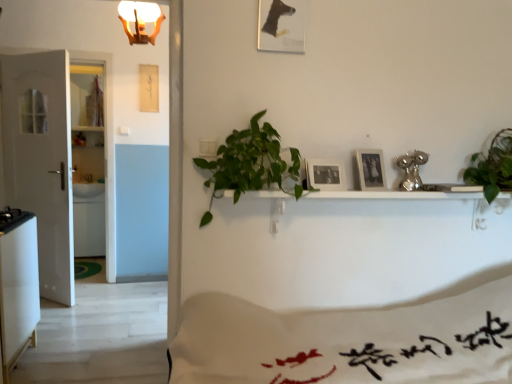
Question: Relative to matte wooden picture frame at upper center, acting as the third picture frame starting from the left, is white glossy refrigerator at lower left in front or behind?

Choices:
 (A) front
 (B) behind

Answer: (B)

Question: In terms of height, does white glossy refrigerator at lower left look taller or shorter compared to matte wooden picture frame at upper center, which appears as the first picture frame when viewed from the right?

Choices:
 (A) short
 (B) tall

Answer: (B)

Question: Which is nearer to the matte wooden picture frame at upper center, which appears as the first picture frame when viewed from the right?

Choices:
 (A) black matte picture frame at center, the 2th picture frame positioned from the right
 (B) white fabric with red text at lower center
 (C) green leafy plant at right, which is the 1th houseplant from right to left
 (D) white glossy refrigerator at lower left
 (E) white matte door at left

Answer: (A)

Question: Which object is positioned farthest from the white glossy refrigerator at lower left?

Choices:
 (A) green leafy plant at right, positioned as the 2th houseplant in left-to-right order
 (B) gold metallic light fixture at upper center
 (C) matte paper picture frame at upper center, the third picture frame in the bottom-to-top sequence
 (D) green leafy plant at center, arranged as the 2th houseplant when viewed from the right
 (E) matte wooden picture frame at upper center, the second picture frame from the bottom

Answer: (A)